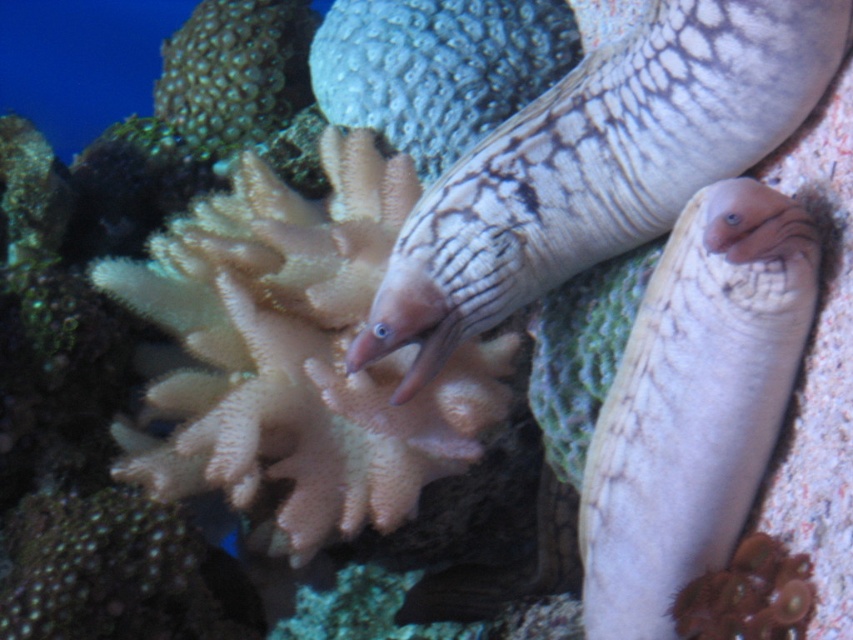
Can you confirm if textured gray coral at center is positioned below green textured coral at upper left?

Correct, textured gray coral at center is located below green textured coral at upper left.

Which of these two, textured gray coral at center or green textured coral at upper left, stands shorter?

green textured coral at upper left is shorter.

Is point (473, 22) positioned in front of point (267, 51)?

Yes, it is.

I want to click on textured gray coral at center, so click(437, 68).

Which is above, white matte coral at center or textured gray coral at center?

textured gray coral at center

Find the location of a particular element. white matte coral at center is located at coordinates (297, 355).

In the scene shown: Who is more distant from viewer, (630, 33) or (219, 106)?

The point (219, 106) is more distant.

In the scene shown: How far apart are speckled white eel at center and green textured coral at upper left?

The distance of speckled white eel at center from green textured coral at upper left is 70.00 centimeters.

Locate an element on the screen. This screenshot has height=640, width=853. speckled white eel at center is located at coordinates (599, 164).